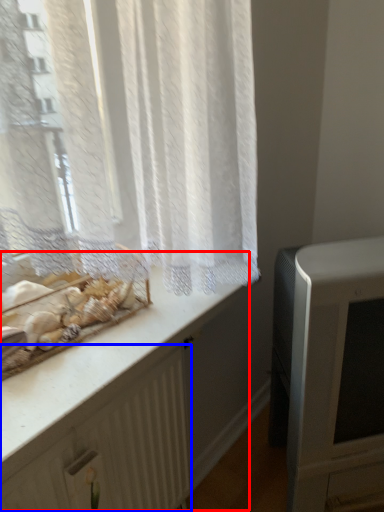
Question: Among these objects, which one is nearest to the camera, counter (highlighted by a red box) or radiator (highlighted by a blue box)?

Choices:
 (A) counter
 (B) radiator

Answer: (A)